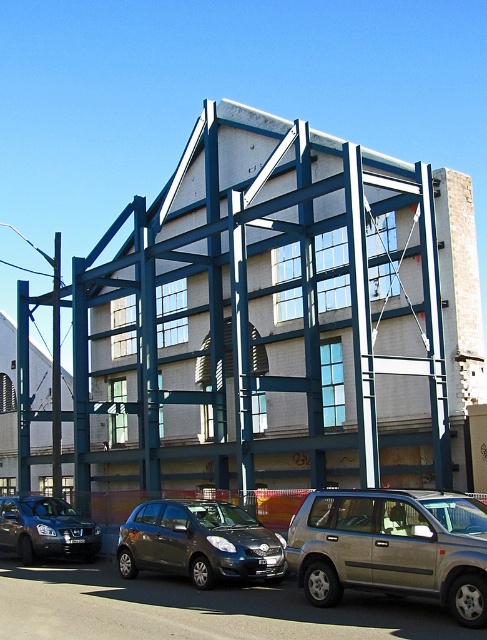
Question: Based on their relative distances, which object is farther from the blue metallic scaffolding at center?

Choices:
 (A) gold metallic suv at center
 (B) matte black sedan at lower left

Answer: (A)

Question: Is blue metallic scaffolding at center in front of matte black sedan at lower left?

Choices:
 (A) yes
 (B) no

Answer: (A)

Question: Which point is closer to the camera?

Choices:
 (A) blue metallic scaffolding at center
 (B) gold metallic suv at center
 (C) matte black sedan at lower left

Answer: (B)

Question: Among these objects, which one is farthest from the camera?

Choices:
 (A) matte black sedan at lower left
 (B) satin dark gray hatchback at center
 (C) blue metallic scaffolding at center
 (D) gold metallic suv at center

Answer: (A)

Question: From the image, what is the correct spatial relationship of blue metallic scaffolding at center in relation to matte black sedan at lower left?

Choices:
 (A) right
 (B) left

Answer: (A)

Question: Can you confirm if gold metallic suv at center is wider than satin dark gray hatchback at center?

Choices:
 (A) no
 (B) yes

Answer: (A)